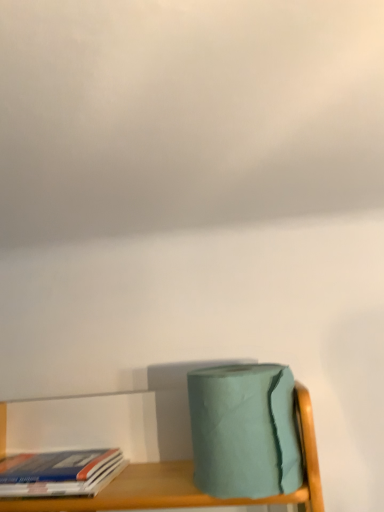
Question: From the image's perspective, does teal matte toilet paper at lower right appear lower than hardcover book at lower left?

Choices:
 (A) yes
 (B) no

Answer: (B)

Question: Could you tell me if teal matte toilet paper at lower right is turned towards hardcover book at lower left?

Choices:
 (A) no
 (B) yes

Answer: (A)

Question: Is teal matte toilet paper at lower right at the right side of hardcover book at lower left?

Choices:
 (A) yes
 (B) no

Answer: (A)

Question: From a real-world perspective, is teal matte toilet paper at lower right on hardcover book at lower left?

Choices:
 (A) no
 (B) yes

Answer: (B)

Question: Considering the relative sizes of teal matte toilet paper at lower right and hardcover book at lower left in the image provided, is teal matte toilet paper at lower right wider than hardcover book at lower left?

Choices:
 (A) no
 (B) yes

Answer: (A)

Question: Relative to hardcover book at lower left, is teal matte toilet paper at lower right in front or behind?

Choices:
 (A) front
 (B) behind

Answer: (A)

Question: Is teal matte toilet paper at lower right bigger or smaller than hardcover book at lower left?

Choices:
 (A) small
 (B) big

Answer: (B)

Question: Is teal matte toilet paper at lower right to the left or to the right of hardcover book at lower left in the image?

Choices:
 (A) left
 (B) right

Answer: (B)

Question: Is teal matte toilet paper at lower right wider or thinner than hardcover book at lower left?

Choices:
 (A) wide
 (B) thin

Answer: (B)

Question: Visually, is cloudy white sky at upper center positioned to the left or to the right of teal matte toilet paper at lower right?

Choices:
 (A) left
 (B) right

Answer: (A)

Question: Is cloudy white sky at upper center bigger or smaller than teal matte toilet paper at lower right?

Choices:
 (A) small
 (B) big

Answer: (B)

Question: From a real-world perspective, is cloudy white sky at upper center positioned above or below teal matte toilet paper at lower right?

Choices:
 (A) below
 (B) above

Answer: (B)

Question: In terms of width, does cloudy white sky at upper center look wider or thinner when compared to teal matte toilet paper at lower right?

Choices:
 (A) wide
 (B) thin

Answer: (A)

Question: Considering their positions, is hardcover book at lower left located in front of or behind cloudy white sky at upper center?

Choices:
 (A) behind
 (B) front

Answer: (A)

Question: From their relative heights in the image, would you say hardcover book at lower left is taller or shorter than cloudy white sky at upper center?

Choices:
 (A) short
 (B) tall

Answer: (A)